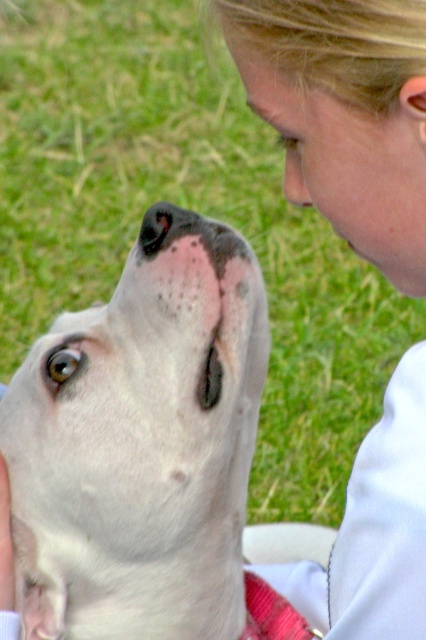
You are using a camera to take a photo of the white smooth dog at center. The camera has a focus point at coordinates 0.694, 0.331. Will the focus point align with the dog?

Yes, the focus point at coordinates (141, 444) will align with the white smooth dog at center because the dog is located exactly at that 2D point.

You are a photographer trying to capture the perfect shot of the white smooth dog at center. To ensure the dog is centered in the frame, you need to adjust your camera. Based on the coordinates provided, is the dog already centered horizontally and vertically? Please explain using the coordinate system where the bottom left corner is the origin point.

The white smooth dog at center is located at coordinates approximately 0.694 on the x axis and 0.331 on the y axis. Since the center of the image would be at coordinates around 0.5 on both axes, the dog is shifted to the right and lower than the true center. To center it, move the camera slightly left and up.

You are a photographer holding a pink soft tissue at upper center and a white smooth dog at center is looking up at you. Can you give the tissue to the dog without moving your hand more than 10 inches from its current position?

The distance between the white smooth dog at center and the pink soft tissue at upper center is 10.51 inches. Since the required distance to move is more than 10 inches, you cannot reach the dog without moving your hand further.